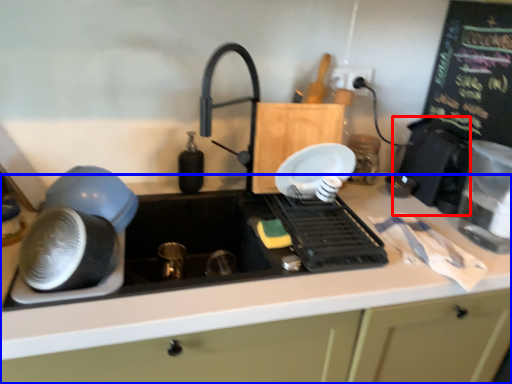
Question: Which of the following is the farthest to the observer, appliance (highlighted by a red box) or countertop (highlighted by a blue box)?

Choices:
 (A) appliance
 (B) countertop

Answer: (A)